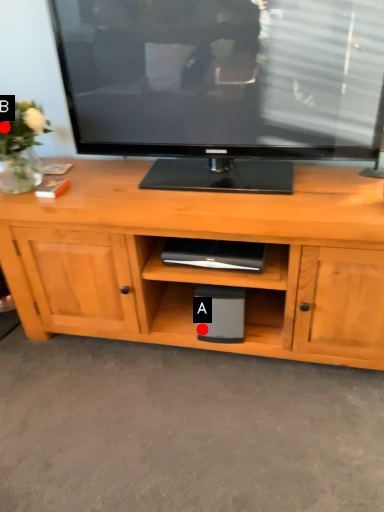
Question: Two points are circled on the image, labeled by A and B beside each circle. Which point is farther to the camera?

Choices:
 (A) A is further
 (B) B is further

Answer: (A)